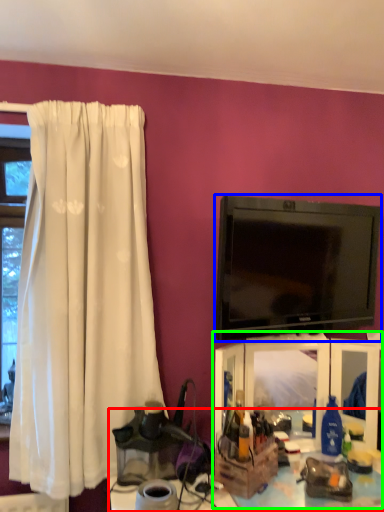
Question: Estimate the real-world distances between objects in this image. Which object is farther from table (highlighted by a red box), television (highlighted by a blue box) or entertainment center (highlighted by a green box)?

Choices:
 (A) television
 (B) entertainment center

Answer: (A)